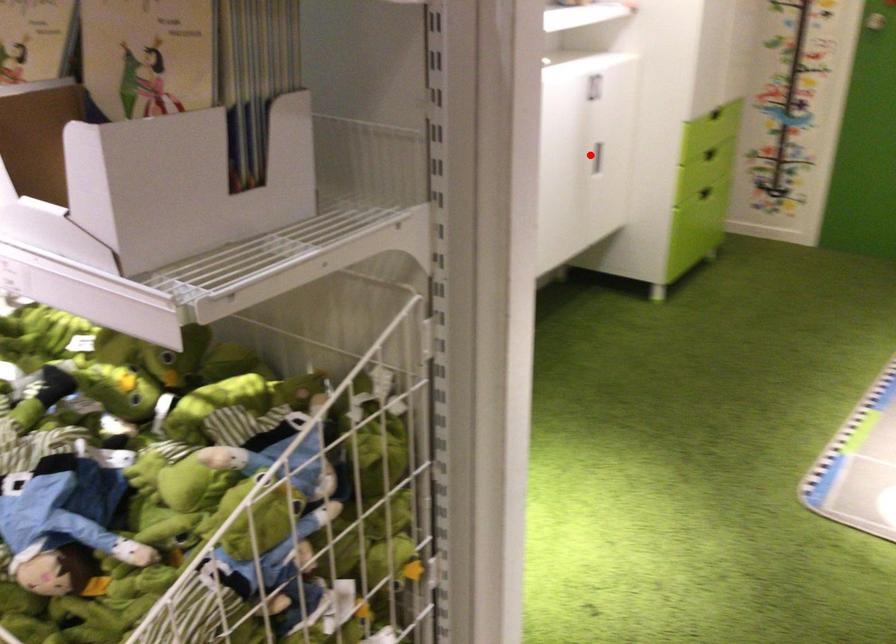
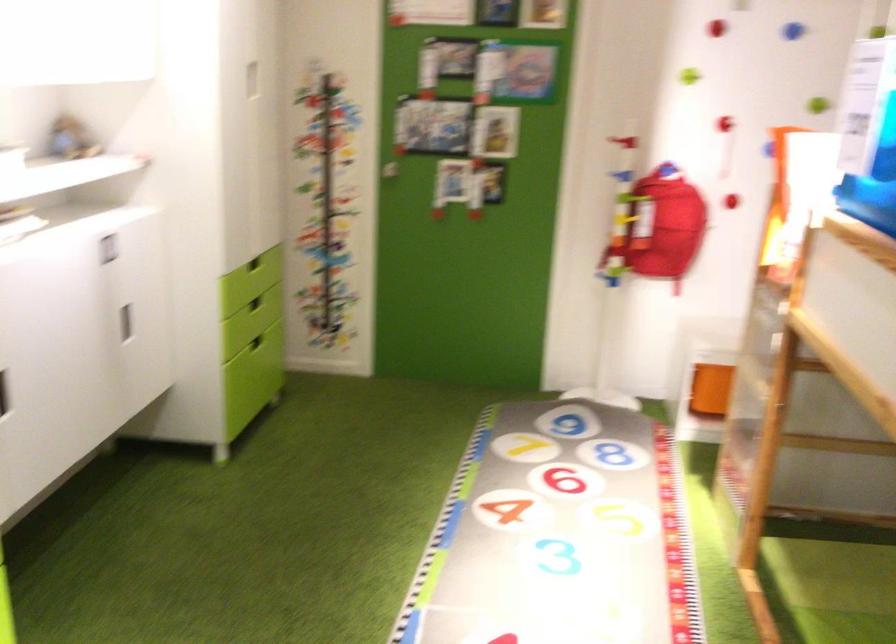
In the second image, find the point that corresponds to the highlighted location in the first image.

(125, 323)